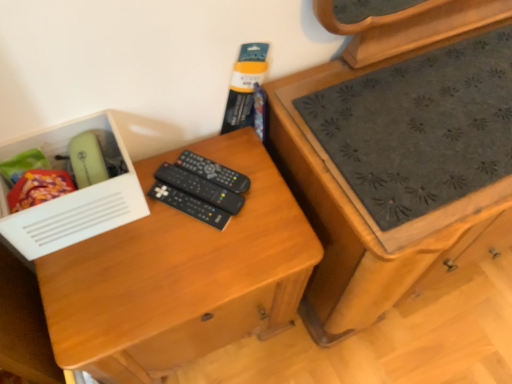
Image resolution: width=512 pixels, height=384 pixels. Find the location of `free location to the left of black plastic remote controls at center, which ranks as the 1th remote control in bottom-to-top order`. free location to the left of black plastic remote controls at center, which ranks as the 1th remote control in bottom-to-top order is located at coordinates (118, 236).